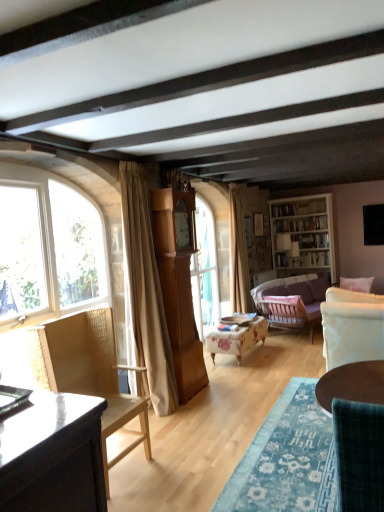
Question: Which direction should I rotate to look at light brown wood grandfather clock at center?

Choices:
 (A) left
 (B) right

Answer: (A)

Question: Is white wooden bookshelf at upper right wider than light brown wood grandfather clock at center?

Choices:
 (A) yes
 (B) no

Answer: (A)

Question: Is the depth of white wooden bookshelf at upper right less than that of light brown wood grandfather clock at center?

Choices:
 (A) yes
 (B) no

Answer: (B)

Question: From a real-world perspective, is white wooden bookshelf at upper right positioned under light brown wood grandfather clock at center based on gravity?

Choices:
 (A) yes
 (B) no

Answer: (B)

Question: Does white wooden bookshelf at upper right have a larger size compared to light brown wood grandfather clock at center?

Choices:
 (A) no
 (B) yes

Answer: (B)

Question: Is white wooden bookshelf at upper right positioned behind light brown wood grandfather clock at center?

Choices:
 (A) yes
 (B) no

Answer: (A)

Question: From the image's perspective, is white wooden bookshelf at upper right on top of light brown wood grandfather clock at center?

Choices:
 (A) yes
 (B) no

Answer: (A)

Question: Does velvet teal chair at lower right, arranged as the 1th chair when viewed from the front, have a greater width compared to beige fabric curtain at left, acting as the 1th curtain starting from the front?

Choices:
 (A) yes
 (B) no

Answer: (A)

Question: Is velvet teal chair at lower right, the third chair when ordered from left to right, thinner than beige fabric curtain at left, the 1th curtain from the left?

Choices:
 (A) yes
 (B) no

Answer: (B)

Question: Is velvet teal chair at lower right, arranged as the 1th chair when viewed from the front, at the left side of beige fabric curtain at left, acting as the 1th curtain starting from the front?

Choices:
 (A) no
 (B) yes

Answer: (A)

Question: Is velvet teal chair at lower right, arranged as the 1th chair when viewed from the front, bigger than beige fabric curtain at left, the 1th curtain from the left?

Choices:
 (A) yes
 (B) no

Answer: (B)

Question: Is velvet teal chair at lower right, which ranks as the 3th chair in back-to-front order, taller than beige fabric curtain at left, the second curtain from the back?

Choices:
 (A) no
 (B) yes

Answer: (A)

Question: Would you say velvet teal chair at lower right, the 1th chair positioned from the right, contains beige fabric curtain at left, placed as the second curtain when sorted from right to left?

Choices:
 (A) yes
 (B) no

Answer: (B)

Question: Is floral fabric ottoman at center, the 1th chair in the back-to-front sequence, located outside light brown wood grandfather clock at center?

Choices:
 (A) no
 (B) yes

Answer: (B)